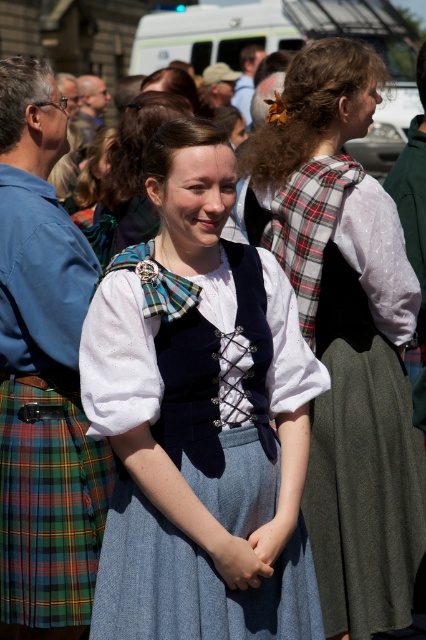
Question: Can you confirm if green plaid kilt at lower left is positioned to the left of matte blue dress at center?

Choices:
 (A) no
 (B) yes

Answer: (B)

Question: Which object is closer to the camera taking this photo?

Choices:
 (A) matte blue dress at center
 (B) plaid fabric dress at center
 (C) plaid fabric at upper center

Answer: (B)

Question: Among these objects, which one is nearest to the camera?

Choices:
 (A) plaid fabric dress at center
 (B) matte blue dress at center

Answer: (A)

Question: Which point is farther to the camera?

Choices:
 (A) denim skirt at center
 (B) plaid fabric dress at center
 (C) green plaid kilt at lower left
 (D) plaid fabric at upper center

Answer: (D)

Question: Is plaid fabric at upper center below matte blue dress at center?

Choices:
 (A) no
 (B) yes

Answer: (B)

Question: In this image, where is denim skirt at center located relative to plaid fabric at upper center?

Choices:
 (A) below
 (B) above

Answer: (A)